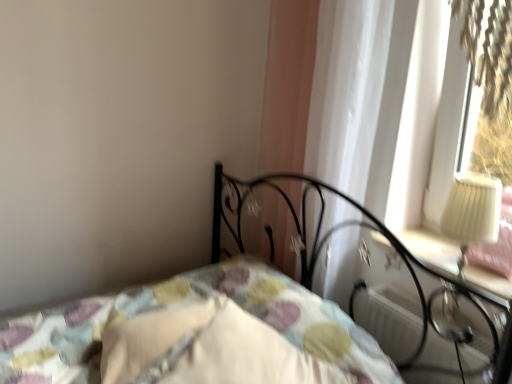
Question: Is white plastic radiator at lower right smaller than white soft pillow at center, marked as the 2th pillow in a left-to-right arrangement?

Choices:
 (A) yes
 (B) no

Answer: (A)

Question: From a real-world perspective, is white plastic radiator at lower right beneath white soft pillow at center, marked as the 2th pillow in a left-to-right arrangement?

Choices:
 (A) yes
 (B) no

Answer: (A)

Question: Does white plastic radiator at lower right have a lesser height compared to white soft pillow at center, the first pillow when ordered from right to left?

Choices:
 (A) yes
 (B) no

Answer: (A)

Question: Is white plastic radiator at lower right outside of white soft pillow at center, marked as the 2th pillow in a left-to-right arrangement?

Choices:
 (A) yes
 (B) no

Answer: (A)

Question: Does white plastic radiator at lower right have a larger size compared to white soft pillow at center, the first pillow when ordered from right to left?

Choices:
 (A) yes
 (B) no

Answer: (B)

Question: Looking at their shapes, would you say patterned fabric bed at center is wider or thinner than white soft pillow at lower center, the 2th pillow in the right-to-left sequence?

Choices:
 (A) thin
 (B) wide

Answer: (B)

Question: Is point (222, 283) positioned closer to the camera than point (145, 340)?

Choices:
 (A) closer
 (B) farther

Answer: (B)

Question: Based on their sizes in the image, would you say patterned fabric bed at center is bigger or smaller than white soft pillow at lower center, which is counted as the 1th pillow, starting from the left?

Choices:
 (A) small
 (B) big

Answer: (B)

Question: From the image's perspective, relative to white soft pillow at lower center, the 2th pillow in the right-to-left sequence, is patterned fabric bed at center above or below?

Choices:
 (A) above
 (B) below

Answer: (B)

Question: Relative to white soft pillow at lower center, which is counted as the 1th pillow, starting from the left, is white sheer curtain at upper right in front or behind?

Choices:
 (A) behind
 (B) front

Answer: (A)

Question: Which is correct: white sheer curtain at upper right is inside white soft pillow at lower center, the 2th pillow in the right-to-left sequence, or outside of it?

Choices:
 (A) inside
 (B) outside

Answer: (B)

Question: From a real-world perspective, is white sheer curtain at upper right above or below white soft pillow at lower center, the 2th pillow in the right-to-left sequence?

Choices:
 (A) below
 (B) above

Answer: (B)

Question: From their relative heights in the image, would you say white sheer curtain at upper right is taller or shorter than white soft pillow at lower center, the 2th pillow in the right-to-left sequence?

Choices:
 (A) short
 (B) tall

Answer: (B)

Question: Considering the positions of white soft pillow at lower center, the 2th pillow in the right-to-left sequence, and patterned fabric bed at center in the image, is white soft pillow at lower center, the 2th pillow in the right-to-left sequence, bigger or smaller than patterned fabric bed at center?

Choices:
 (A) small
 (B) big

Answer: (A)

Question: From a real-world perspective, is white soft pillow at lower center, which is counted as the 1th pillow, starting from the left, above or below patterned fabric bed at center?

Choices:
 (A) above
 (B) below

Answer: (B)